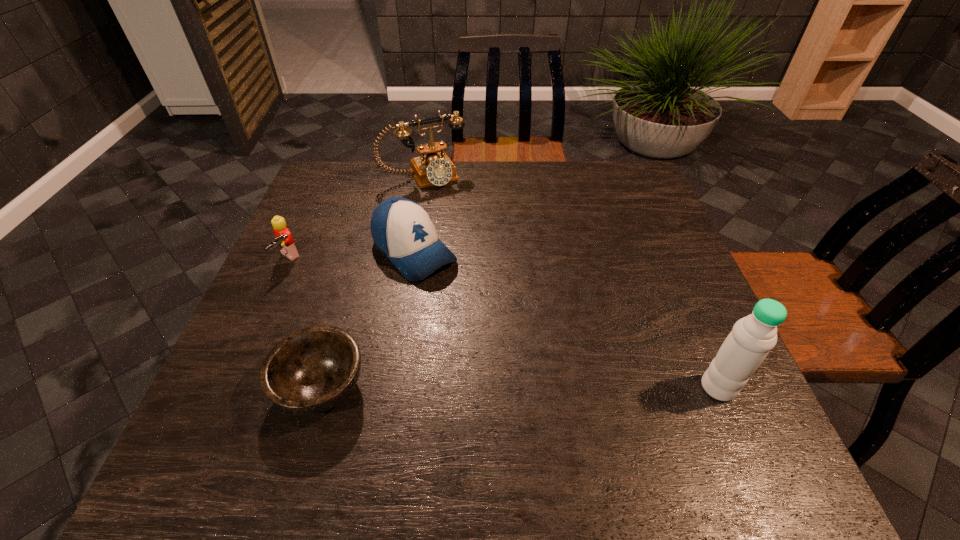
Where is `free spot on the desktop that is between the bowl and the rightmost object and is positioned in front of the Lego with the accessory visible`? Image resolution: width=960 pixels, height=540 pixels. free spot on the desktop that is between the bowl and the rightmost object and is positioned in front of the Lego with the accessory visible is located at coordinates (469, 387).

Locate an element on the screen. This screenshot has width=960, height=540. vacant space on the desktop that is between the bowl and the tallest object and is positioned on the front-facing side of the baseball cap is located at coordinates (564, 387).

The width and height of the screenshot is (960, 540). Find the location of `free space on the desktop that is between the bowl and the tallest object and is positioned on the dial number of the farthest object`. free space on the desktop that is between the bowl and the tallest object and is positioned on the dial number of the farthest object is located at coordinates (554, 387).